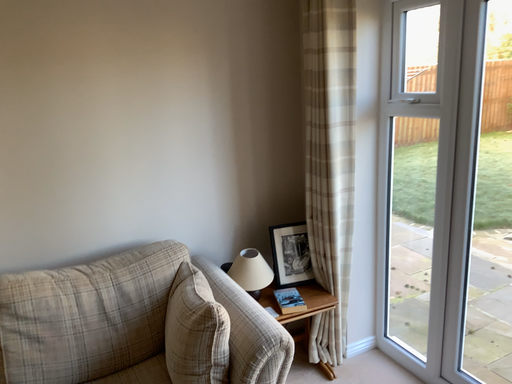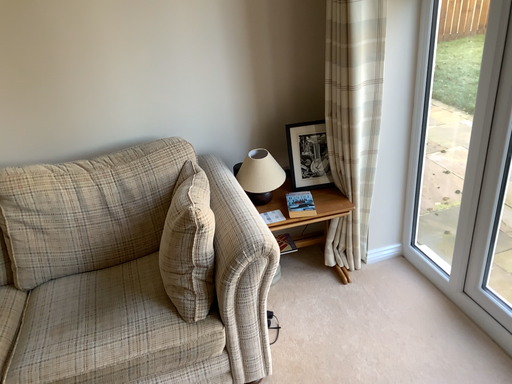
Question: Which way did the camera rotate in the video?

Choices:
 (A) rotated right
 (B) rotated left

Answer: (B)